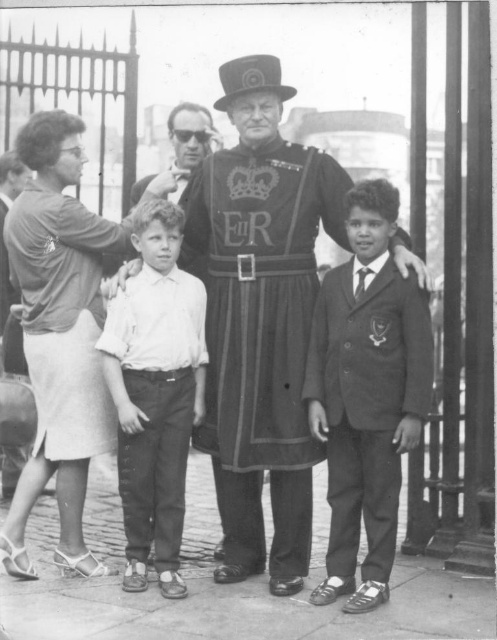
Is smooth black suit at center to the right of white cotton shirt at center from the viewer's perspective?

Correct, you'll find smooth black suit at center to the right of white cotton shirt at center.

Is smooth black suit at center shorter than white cotton shirt at center?

In fact, smooth black suit at center may be taller than white cotton shirt at center.

Does point (401, 321) come in front of point (169, 432)?

Yes, it is.

This screenshot has height=640, width=497. I want to click on smooth black suit at center, so click(x=366, y=394).